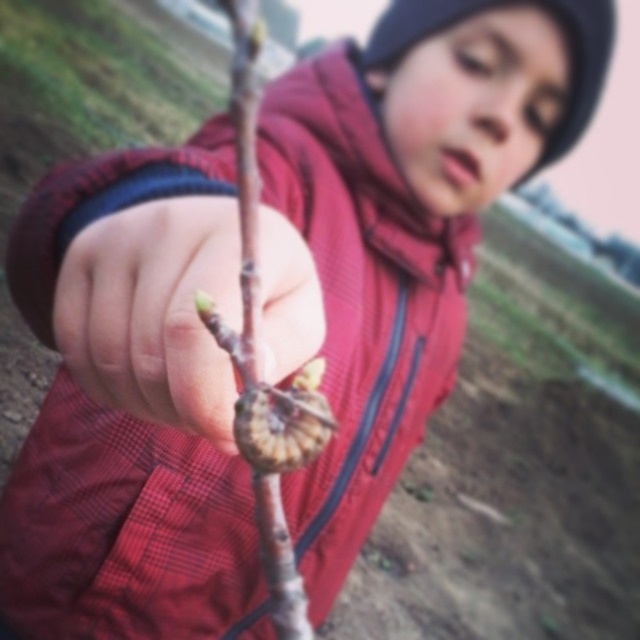
You are a photographer trying to capture the child holding the branch with the caterpillar. Based on the scene, where should you focus your camera to ensure the smooth skin hand at center is in sharp focus?

You should focus your camera at point (154, 312) to ensure the smooth skin hand at center is in sharp focus.